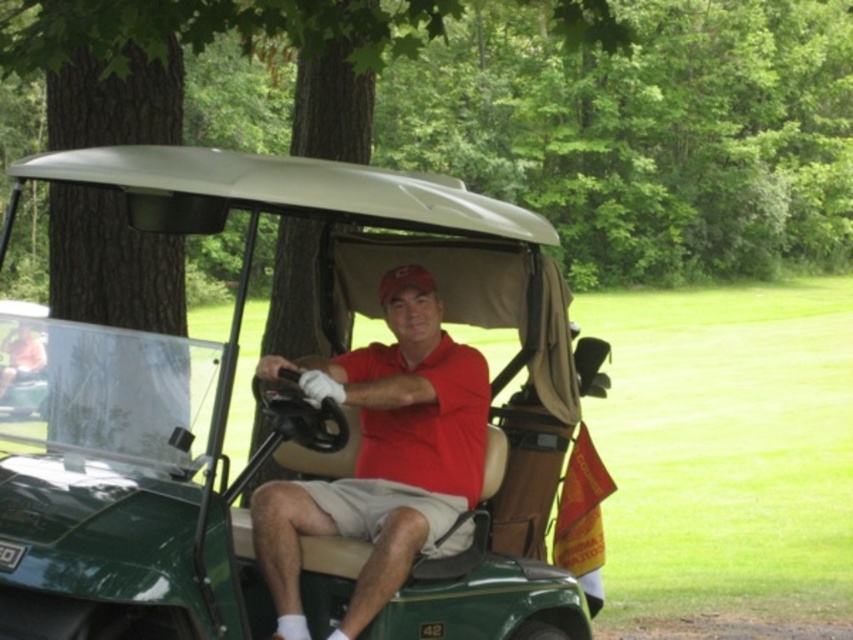
Question: Which object appears farthest from the camera in this image?

Choices:
 (A) matte red shirt at center
 (B) green matte golf cart at center

Answer: (A)

Question: Among these points, which one is nearest to the camera?

Choices:
 (A) (349, 509)
 (B) (447, 588)

Answer: (B)

Question: Does green matte golf cart at center have a smaller size compared to matte red shirt at center?

Choices:
 (A) yes
 (B) no

Answer: (B)

Question: Observing the image, what is the correct spatial positioning of green matte golf cart at center in reference to matte red shirt at center?

Choices:
 (A) left
 (B) right

Answer: (A)

Question: Is green matte golf cart at center below matte red shirt at center?

Choices:
 (A) no
 (B) yes

Answer: (A)